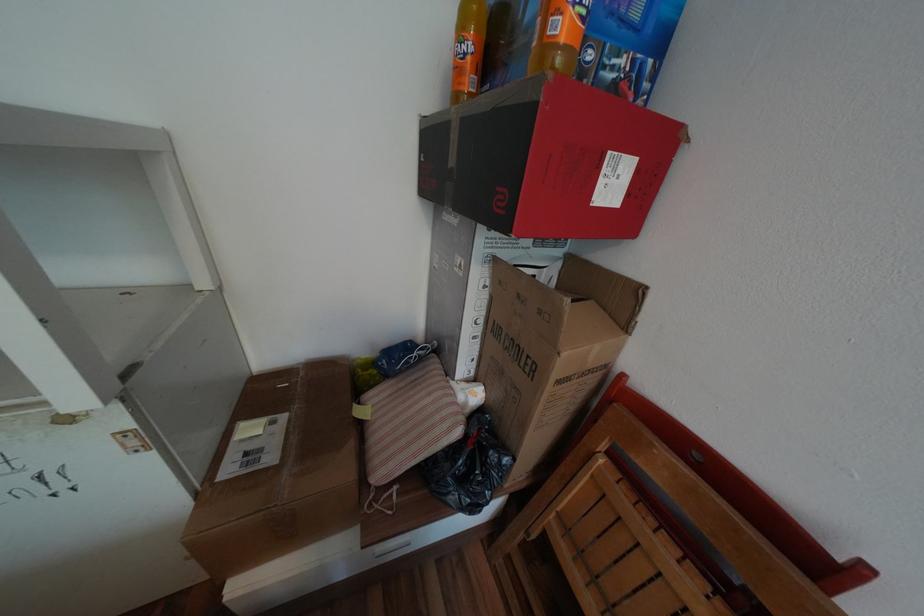
Locate an element on the screen. This screenshot has height=616, width=924. air cooler box is located at coordinates (282, 472).